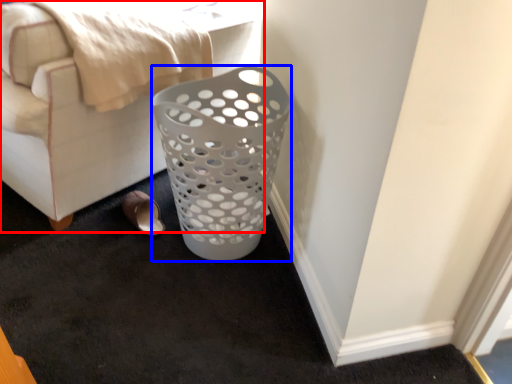
Question: Which object appears farthest to the camera in this image, furniture (highlighted by a red box) or basket (highlighted by a blue box)?

Choices:
 (A) furniture
 (B) basket

Answer: (B)